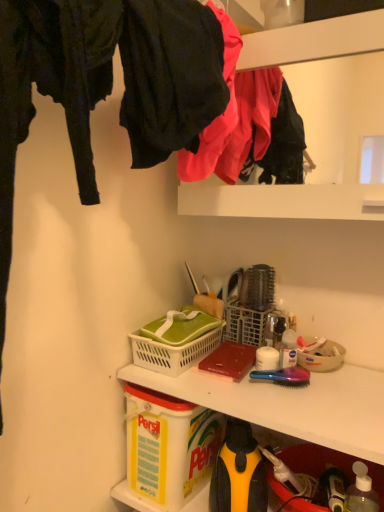
Question: Is beige plastic bowl at center right touching transparent plastic bottle at lower right, which appears as the second bottle when viewed from the left?

Choices:
 (A) yes
 (B) no

Answer: (B)

Question: Does beige plastic bowl at center right lie behind transparent plastic bottle at lower right, the 1th bottle when ordered from front to back?

Choices:
 (A) no
 (B) yes

Answer: (B)

Question: From a real-world perspective, is beige plastic bowl at center right on transparent plastic bottle at lower right, which appears as the second bottle when viewed from the left?

Choices:
 (A) yes
 (B) no

Answer: (A)

Question: Is beige plastic bowl at center right oriented towards transparent plastic bottle at lower right, which is counted as the 1th bottle, starting from the right?

Choices:
 (A) yes
 (B) no

Answer: (B)

Question: Does beige plastic bowl at center right have a greater height compared to transparent plastic bottle at lower right, the first bottle in the bottom-to-top sequence?

Choices:
 (A) no
 (B) yes

Answer: (A)

Question: From a real-world perspective, is beige plastic bowl at center right physically located above or below matte pink fabric at upper center, the 2th clothing in the front-to-back sequence?

Choices:
 (A) below
 (B) above

Answer: (A)

Question: Is beige plastic bowl at center right inside or outside of matte pink fabric at upper center, the 2th clothing in the front-to-back sequence?

Choices:
 (A) outside
 (B) inside

Answer: (A)

Question: Considering the positions of beige plastic bowl at center right and matte pink fabric at upper center, acting as the 1th clothing starting from the back, in the image, is beige plastic bowl at center right bigger or smaller than matte pink fabric at upper center, acting as the 1th clothing starting from the back,?

Choices:
 (A) small
 (B) big

Answer: (A)

Question: Is beige plastic bowl at center right in front of or behind matte pink fabric at upper center, the 2th clothing in the front-to-back sequence, in the image?

Choices:
 (A) front
 (B) behind

Answer: (B)

Question: Would you say matte black pants at upper left, which ranks as the second clothing in back-to-front order, is to the left or to the right of white plastic picnic basket at center in the picture?

Choices:
 (A) right
 (B) left

Answer: (B)

Question: Does point (153, 73) appear closer or farther from the camera than point (190, 330)?

Choices:
 (A) farther
 (B) closer

Answer: (B)

Question: Based on their sizes in the image, would you say matte black pants at upper left, which ranks as the second clothing in back-to-front order, is bigger or smaller than white plastic picnic basket at center?

Choices:
 (A) small
 (B) big

Answer: (B)

Question: From a real-world perspective, is matte black pants at upper left, which ranks as the second clothing in back-to-front order, physically located above or below white plastic picnic basket at center?

Choices:
 (A) above
 (B) below

Answer: (A)

Question: Considering their positions, is matte black pants at upper left, which ranks as the second clothing in back-to-front order, located in front of or behind white plastic bottle at center, the 1th bottle from the back?

Choices:
 (A) behind
 (B) front

Answer: (B)

Question: Is point (193, 19) closer or farther from the camera than point (291, 362)?

Choices:
 (A) farther
 (B) closer

Answer: (B)